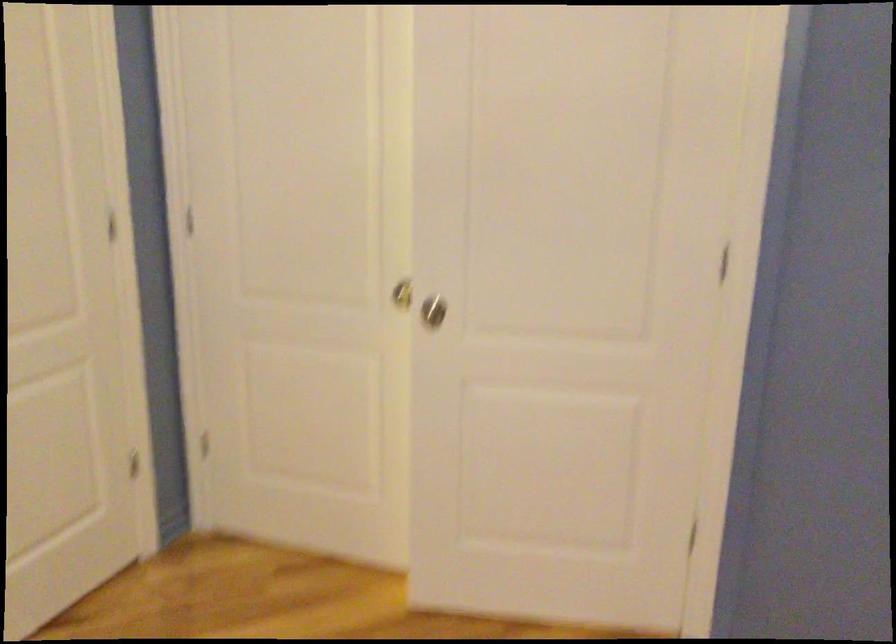
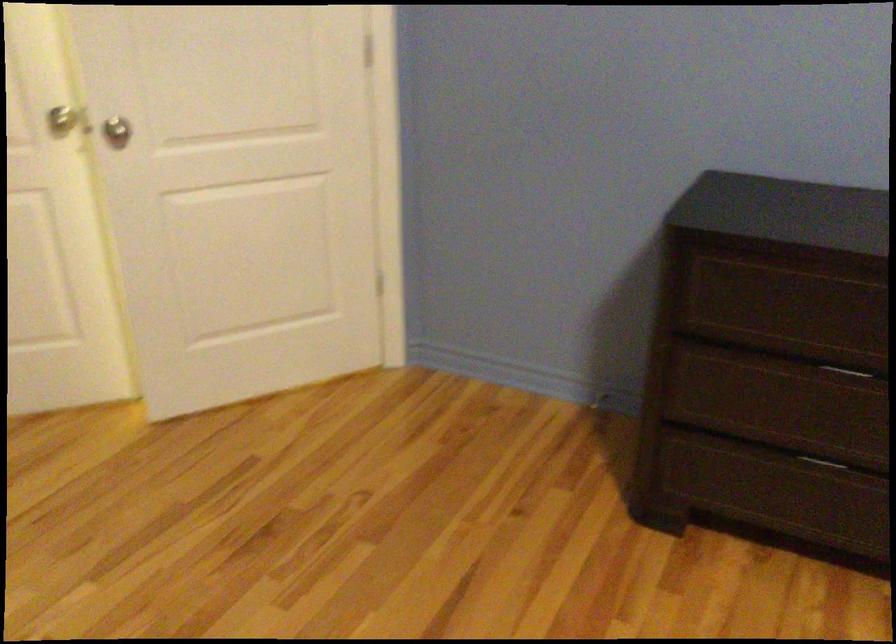
Find the pixel in the second image that matches [417,292] in the first image.

(62, 118)